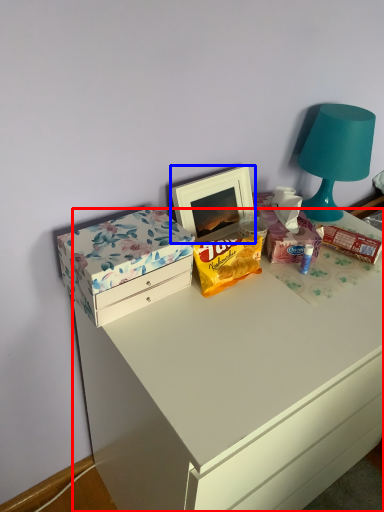
Question: Which point is further to the camera, desk (highlighted by a red box) or picture frame (highlighted by a blue box)?

Choices:
 (A) desk
 (B) picture frame

Answer: (B)